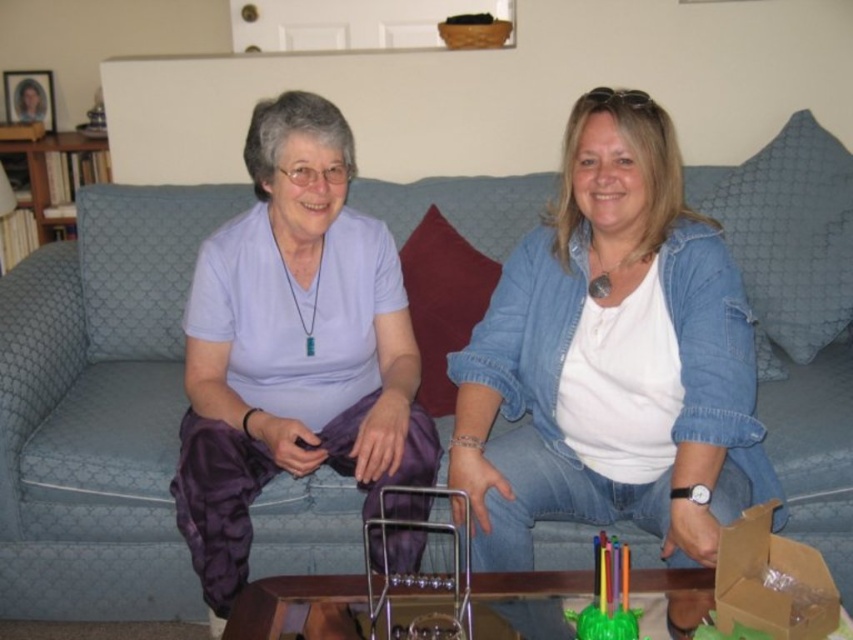
Does white matte shirt at center lie behind translucent plastic toy at center?

Yes.

Can you confirm if white matte shirt at center is taller than translucent plastic toy at center?

Yes.

Which is in front, point (548, 394) or point (614, 628)?

Positioned in front is point (614, 628).

The height and width of the screenshot is (640, 853). Identify the location of white matte shirt at center. (612, 356).

Consider the image. Is white matte shirt at center taller than purple satin pants at center?

No.

Can you confirm if white matte shirt at center is positioned above purple satin pants at center?

Correct, white matte shirt at center is located above purple satin pants at center.

Identify the location of white matte shirt at center. (612, 356).

Between purple satin pants at center and translucent plastic toy at center, which one is positioned higher?

purple satin pants at center is higher up.

Which of these two, purple satin pants at center or translucent plastic toy at center, stands shorter?

translucent plastic toy at center

Looking at this image, who is more forward, (293, 449) or (612, 552)?

Point (612, 552) is more forward.

I want to click on purple satin pants at center, so click(x=293, y=346).